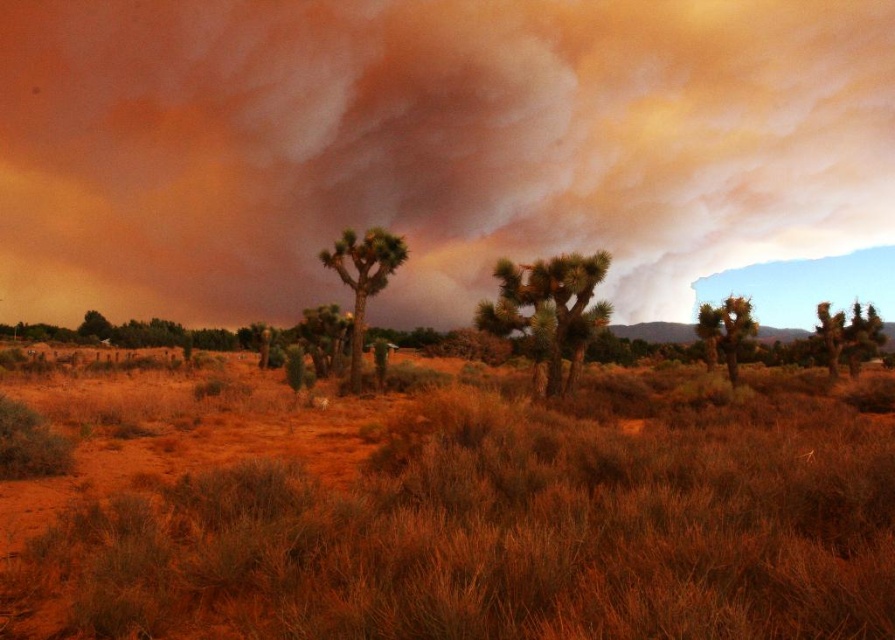
You are standing in the desert landscape and see a point marked at coordinates (362, 278). What object is located at that point?

The point at coordinates (362, 278) indicates a green textured tree at center.

Consider the image. You are an artist planning to paint the desert scene. You want to ensure the brown textured joshua tree at center and the green textured tree at center are proportionally accurate. Which tree should you draw wider in your painting?

The green textured tree at center should be drawn wider since it has a greater width than the brown textured joshua tree at center according to the description.